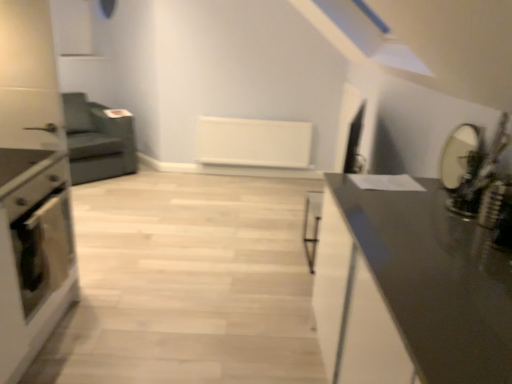
What do you see at coordinates (253, 142) in the screenshot?
I see `white matte radiator at center` at bounding box center [253, 142].

In order to face matte black mirror at right, should I rotate leftwards or rightwards?

Turn right by 25.270 degrees to look at matte black mirror at right.

Image resolution: width=512 pixels, height=384 pixels. What do you see at coordinates (461, 156) in the screenshot? I see `matte black mirror at right` at bounding box center [461, 156].

Where is `dark gray fabric armchair at left`? dark gray fabric armchair at left is located at coordinates (98, 139).

Which point is more forward, (449, 177) or (29, 214)?

The point (29, 214) is in front.

Is matte black mirror at right spatially inside matte black oven at left, or outside of it?

matte black mirror at right is outside matte black oven at left.

From a real-world perspective, is matte black mirror at right positioned over matte black oven at left based on gravity?

Yes.

Looking at this image, are matte black mirror at right and matte black oven at left far apart?

Yes, matte black mirror at right and matte black oven at left are located far from each other.

From a real-world perspective, is matte black oven at left above or below matte black oven at left?

matte black oven at left is situated higher than matte black oven at left in the real world.

Is matte black oven at left bigger or smaller than matte black oven at left?

In the image, matte black oven at left appears to be smaller than matte black oven at left.

Considering the relative sizes of matte black oven at left and matte black oven at left in the image provided, is matte black oven at left wider than matte black oven at left?

No.

Do you think dark gray fabric armchair at left is within white matte radiator at center, or outside of it?

dark gray fabric armchair at left is not enclosed by white matte radiator at center.

Can you see dark gray fabric armchair at left touching white matte radiator at center?

They are not placed beside each other.

From a real-world perspective, between dark gray fabric armchair at left and white matte radiator at center, who is vertically higher?

In real-world perspective, dark gray fabric armchair at left is above.

Between dark gray fabric armchair at left and white matte radiator at center, which one is positioned behind?

white matte radiator at center is behind.

Are matte black mirror at right and white matte radiator at center located far from each other?

matte black mirror at right is positioned a significant distance from white matte radiator at center.

The height and width of the screenshot is (384, 512). I want to click on appliance in front of the white matte radiator at center, so click(461, 156).

Visually, is matte black mirror at right positioned to the left or to the right of white matte radiator at center?

From the image, it's evident that matte black mirror at right is to the right of white matte radiator at center.

Looking at this image, is matte black mirror at right bigger or smaller than white matte radiator at center?

matte black mirror at right is smaller than white matte radiator at center.

Where is `home appliance below the brushed metal drawer at left (from the image's perspective)`? The height and width of the screenshot is (384, 512). home appliance below the brushed metal drawer at left (from the image's perspective) is located at coordinates (33, 253).

Looking at this image, is brushed metal drawer at left far away from matte black oven at left?

No.

Between brushed metal drawer at left and matte black oven at left, which one has less height?

brushed metal drawer at left.

Is brushed metal drawer at left positioned behind matte black oven at left?

No, brushed metal drawer at left is closer to the camera.

The width and height of the screenshot is (512, 384). I want to click on oven that appears above the white matte radiator at center (from a real-world perspective), so click(42, 248).

How far apart are white matte radiator at center and matte black oven at left?

white matte radiator at center is 9.07 feet away from matte black oven at left.

Looking at the image, does white matte radiator at center seem bigger or smaller compared to matte black oven at left?

Considering their sizes, white matte radiator at center takes up more space than matte black oven at left.

Is white matte radiator at center facing towards matte black oven at left?

Yes, white matte radiator at center is aimed at matte black oven at left.

From a real-world perspective, is white matte radiator at center physically below matte black mirror at right?

Yes, from a real-world perspective, white matte radiator at center is below matte black mirror at right.

Which of these two, white matte radiator at center or matte black mirror at right, stands taller?

Standing taller between the two is white matte radiator at center.

Which is more to the right, white matte radiator at center or matte black mirror at right?

matte black mirror at right.

How many degrees apart are the facing directions of white matte radiator at center and matte black mirror at right?

The angle between the facing direction of white matte radiator at center and the facing direction of matte black mirror at right is 90.1 degrees.

At what (x,y) coordinates should I click in order to perform the action: click on home appliance on the left of matte black mirror at right. Please return your answer as a coordinate pair (x, y). Image resolution: width=512 pixels, height=384 pixels. Looking at the image, I should click on (33, 253).

This screenshot has width=512, height=384. Identify the location of home appliance below the matte black oven at left (from a real-world perspective). 33,253.

Based on their spatial positions, is matte black oven at left or matte black mirror at right closer to brushed metal drawer at left?

The object closer to brushed metal drawer at left is matte black oven at left.

From the image, which object appears to be nearer to matte black oven at left, matte black oven at left or white matte radiator at center?

matte black oven at left is positioned closer to the anchor matte black oven at left.

From the image, which object appears to be nearer to matte black mirror at right, matte black oven at left or white matte radiator at center?

matte black oven at left is positioned closer to the anchor matte black mirror at right.

Looking at the image, which one is located closer to matte black oven at left, dark gray fabric armchair at left or matte black mirror at right?

Among the two, matte black mirror at right is located nearer to matte black oven at left.

Considering their positions, is matte black mirror at right positioned further to white matte radiator at center than dark gray fabric armchair at left?

matte black mirror at right is further to white matte radiator at center.

Based on their spatial positions, is brushed metal drawer at left or matte black oven at left closer to matte black mirror at right?

brushed metal drawer at left lies closer to matte black mirror at right than the other object.

Based on their spatial positions, is matte black oven at left or white matte radiator at center further from dark gray fabric armchair at left?

Among the two, matte black oven at left is located further to dark gray fabric armchair at left.

Considering their positions, is white matte radiator at center positioned closer to matte black mirror at right than dark gray fabric armchair at left?

Among the two, white matte radiator at center is located nearer to matte black mirror at right.

Locate an element on the screen. This screenshot has width=512, height=384. drawer between dark gray fabric armchair at left and matte black mirror at right in the horizontal direction is located at coordinates (35, 189).

You are a GUI agent. You are given a task and a screenshot of the screen. Output one action in this format:
    pyautogui.click(x=<x>, y=<y>)
    Task: Click on the drawer between matte black oven at left and matte black mirror at right in the horizontal direction
    This screenshot has height=384, width=512.
    Given the screenshot: What is the action you would take?
    pyautogui.click(x=35, y=189)

You are a GUI agent. You are given a task and a screenshot of the screen. Output one action in this format:
    pyautogui.click(x=<x>, y=<y>)
    Task: Click on the oven situated between brushed metal drawer at left and matte black mirror at right from left to right
    This screenshot has height=384, width=512.
    Given the screenshot: What is the action you would take?
    pyautogui.click(x=42, y=248)

Identify the location of armchair located between matte black oven at left and white matte radiator at center in the depth direction. This screenshot has width=512, height=384. (98, 139).